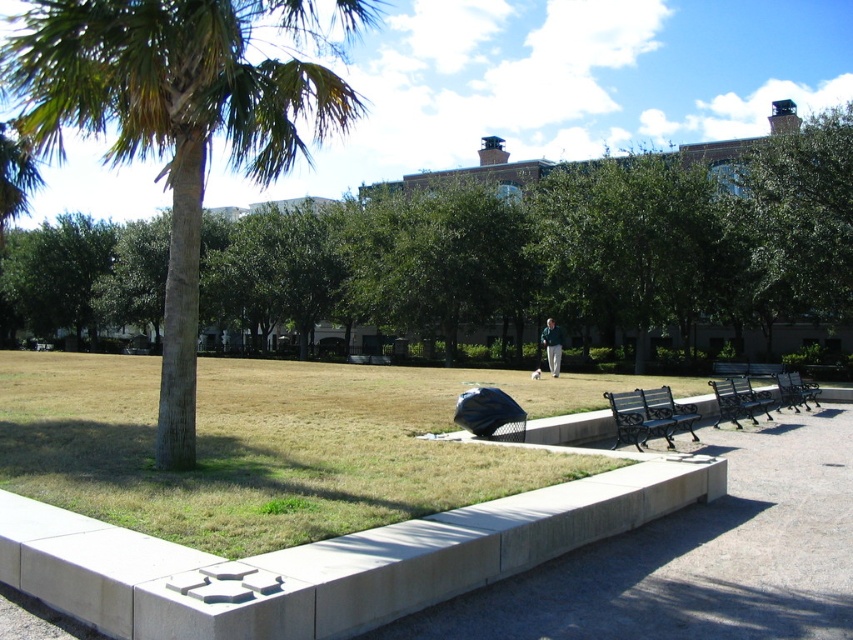
Is point (766, 408) farther from viewer compared to point (798, 372)?

That is False.

Is wooden park bench at lower right to the right of metallic silver bench at center from the viewer's perspective?

Incorrect, wooden park bench at lower right is not on the right side of metallic silver bench at center.

Measure the distance between wooden park bench at lower right and camera.

wooden park bench at lower right and camera are 45.86 feet apart from each other.

Identify the location of wooden park bench at lower right. This screenshot has height=640, width=853. (740, 401).

Can you confirm if metallic silver bench at center is positioned below light brown leather jacket at center?

Yes.

Does metallic silver bench at center appear on the left side of light brown leather jacket at center?

No, metallic silver bench at center is not to the left of light brown leather jacket at center.

Is point (798, 406) positioned before point (556, 342)?

Yes, point (798, 406) is in front of point (556, 342).

This screenshot has width=853, height=640. I want to click on metallic silver bench at center, so click(795, 392).

Is green leafy tree at center wider than black wrought iron bench at lower right?

Yes, green leafy tree at center is wider than black wrought iron bench at lower right.

Can you confirm if green leafy tree at center is bigger than black wrought iron bench at lower right?

Indeed, green leafy tree at center has a larger size compared to black wrought iron bench at lower right.

Is point (473, 292) behind point (662, 397)?

Yes, it is.

Where is `green leafy tree at center`? green leafy tree at center is located at coordinates (560, 248).